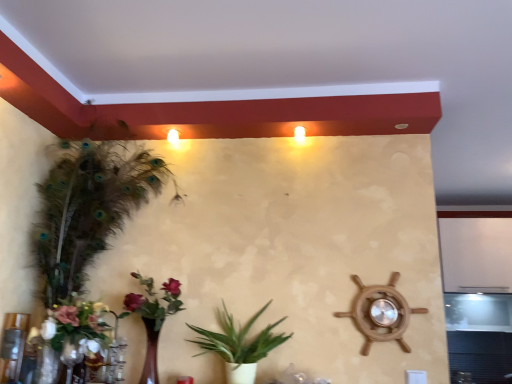
Question: Is the position of matte wooden vase with flowers at lower left, which ranks as the 1th floral arrangement in right-to-left order, more distant than that of white matte floral arrangement at lower left, marked as the 2th floral arrangement in a right-to-left arrangement?

Choices:
 (A) no
 (B) yes

Answer: (B)

Question: Is matte wooden vase with flowers at lower left, the 2th floral arrangement in the left-to-right sequence, to the right of white matte floral arrangement at lower left, the first floral arrangement viewed from the left, from the viewer's perspective?

Choices:
 (A) yes
 (B) no

Answer: (A)

Question: Are matte wooden vase with flowers at lower left, the 2th floral arrangement in the left-to-right sequence, and white matte floral arrangement at lower left, the first floral arrangement viewed from the left, making contact?

Choices:
 (A) yes
 (B) no

Answer: (B)

Question: Is matte wooden vase with flowers at lower left, which ranks as the 1th floral arrangement in right-to-left order, shorter than white matte floral arrangement at lower left, marked as the 2th floral arrangement in a right-to-left arrangement?

Choices:
 (A) no
 (B) yes

Answer: (A)

Question: From the image's perspective, is matte wooden vase with flowers at lower left, the 2th floral arrangement in the left-to-right sequence, on top of white matte floral arrangement at lower left, marked as the 2th floral arrangement in a right-to-left arrangement?

Choices:
 (A) no
 (B) yes

Answer: (B)

Question: From the image's perspective, relative to green leafy plant at center, positioned as the 2th houseplant in left-to-right order, is matte wooden vase with flowers at lower left, which ranks as the 1th floral arrangement in right-to-left order, above or below?

Choices:
 (A) above
 (B) below

Answer: (A)

Question: From a real-world perspective, is matte wooden vase with flowers at lower left, the 2th floral arrangement in the left-to-right sequence, positioned above or below green leafy plant at center, the 1th houseplant viewed from the right?

Choices:
 (A) below
 (B) above

Answer: (B)

Question: Relative to green leafy plant at center, the 1th houseplant viewed from the right, is matte wooden vase with flowers at lower left, the 2th floral arrangement in the left-to-right sequence, in front or behind?

Choices:
 (A) front
 (B) behind

Answer: (B)

Question: Is point (142, 311) closer or farther from the camera than point (254, 317)?

Choices:
 (A) farther
 (B) closer

Answer: (B)

Question: Looking at the image, does green leafy plant at center, positioned as the 2th houseplant in left-to-right order, seem bigger or smaller compared to matte wooden vase with flowers at lower left, the 2th floral arrangement in the left-to-right sequence?

Choices:
 (A) big
 (B) small

Answer: (A)

Question: From a real-world perspective, is green leafy plant at center, positioned as the 2th houseplant in left-to-right order, physically located above or below matte wooden vase with flowers at lower left, the 2th floral arrangement in the left-to-right sequence?

Choices:
 (A) below
 (B) above

Answer: (A)

Question: From the image's perspective, is green leafy plant at center, positioned as the 2th houseplant in left-to-right order, above or below matte wooden vase with flowers at lower left, the 2th floral arrangement in the left-to-right sequence?

Choices:
 (A) below
 (B) above

Answer: (A)

Question: Would you say green leafy plant at center, positioned as the 2th houseplant in left-to-right order, is inside or outside matte wooden vase with flowers at lower left, the 2th floral arrangement in the left-to-right sequence?

Choices:
 (A) outside
 (B) inside

Answer: (A)

Question: Is point (45, 266) closer or farther from the camera than point (146, 367)?

Choices:
 (A) closer
 (B) farther

Answer: (B)

Question: From a real-world perspective, is green feathered houseplant at left, arranged as the second houseplant when viewed from the right, above or below matte wooden vase with flowers at lower left, the 2th floral arrangement in the left-to-right sequence?

Choices:
 (A) below
 (B) above

Answer: (B)